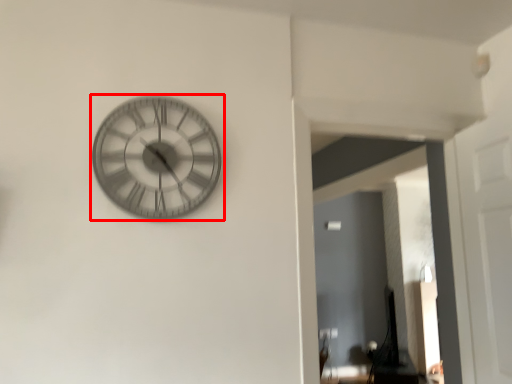
Question: From the image's perspective, where is wall clock (annotated by the red box) located in relation to glass door in the image?

Choices:
 (A) above
 (B) below

Answer: (A)